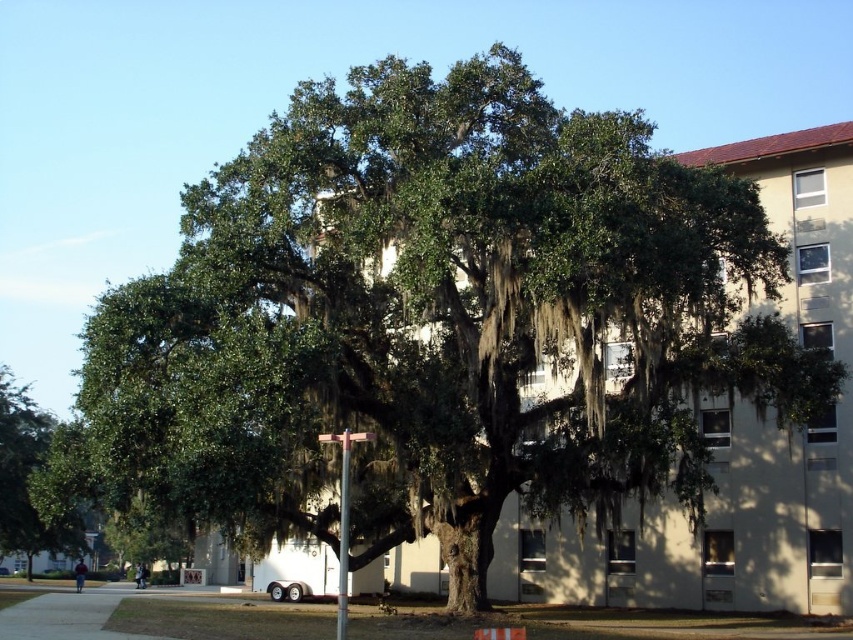
Who is taller, green grass at lower center or green leafy tree at lower left?

green leafy tree at lower left

Who is more distant from viewer, (520, 621) or (9, 387)?

Point (9, 387)

Where is `green grass at lower center`? The height and width of the screenshot is (640, 853). green grass at lower center is located at coordinates (154, 614).